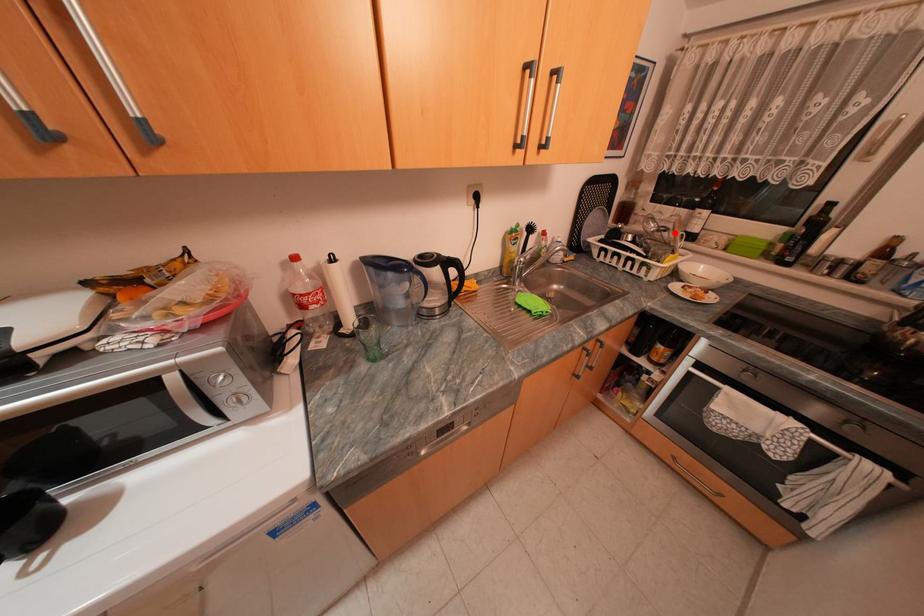
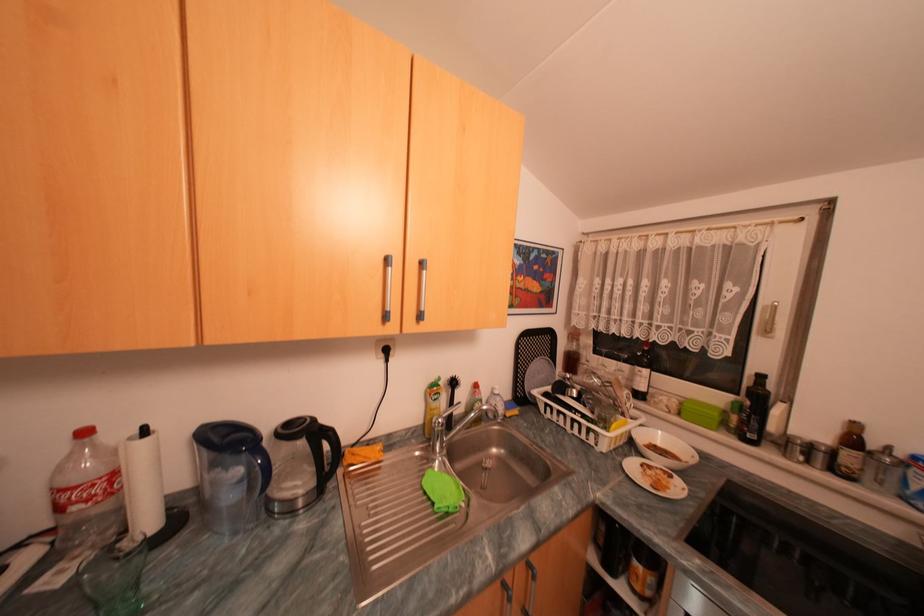
Question: I am providing you with two images of the same scene from different viewpoints. A red point is shown in image1. For the corresponding object point in image2, is it positioned nearer or farther from the camera?

Choices:
 (A) Nearer
 (B) Farther

Answer: (B)